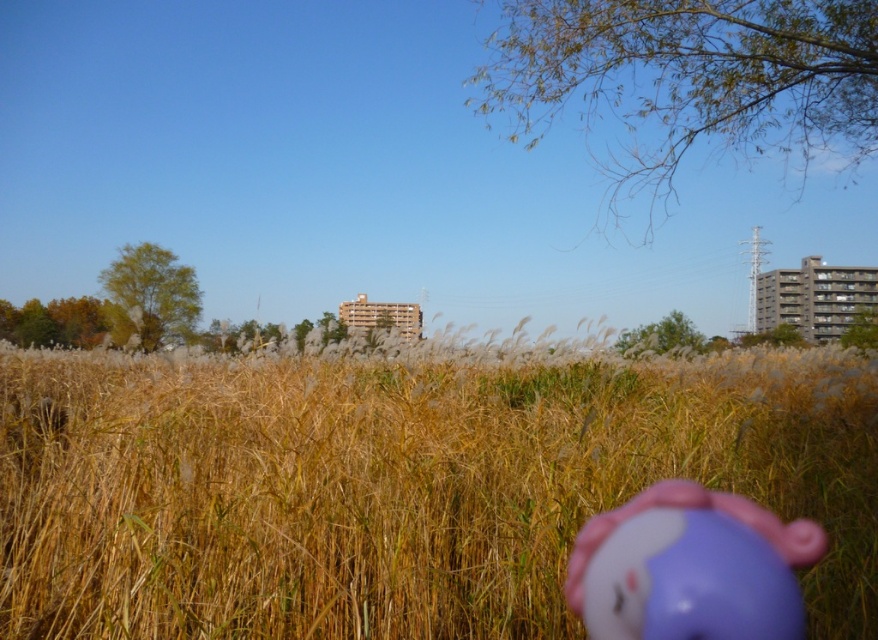
You are a child playing in the yellow dry grass at center and see the purple matte toy at center. Which object is wider?

The yellow dry grass at center is wider than the purple matte toy at center.

Consider the image. You are standing in the field of tall golden grasses shown in the image. You notice a specific point marked at coordinates (397,486). What is located at that point?

The point at coordinates (397,486) indicates yellow dry grass at center.

You are standing in the middle of the yellow dry grass at center and see the purple matte toy at center. Which direction should you move to reach the toy?

You should move to your right to reach the purple matte toy at center since the yellow dry grass at center is to the left of the purple matte toy at center.